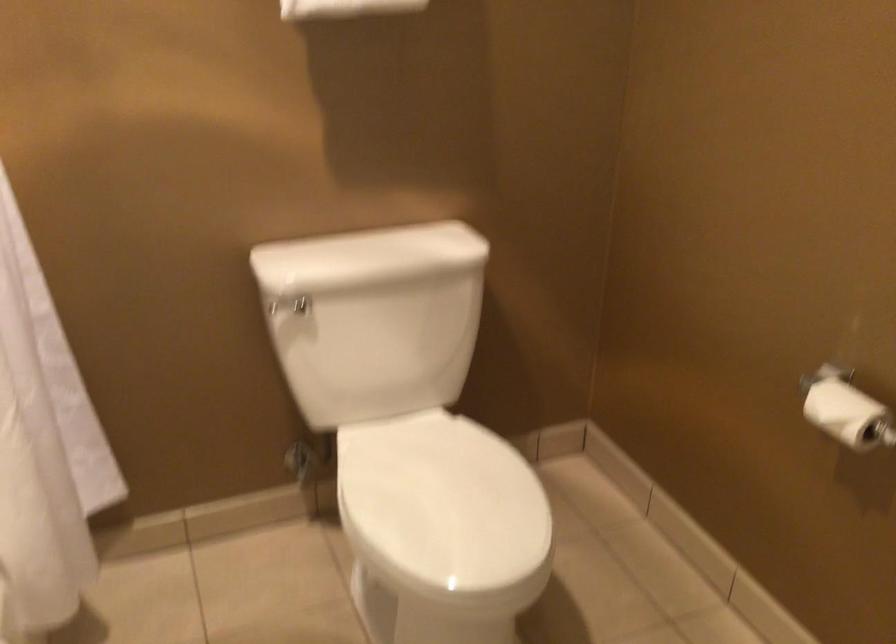
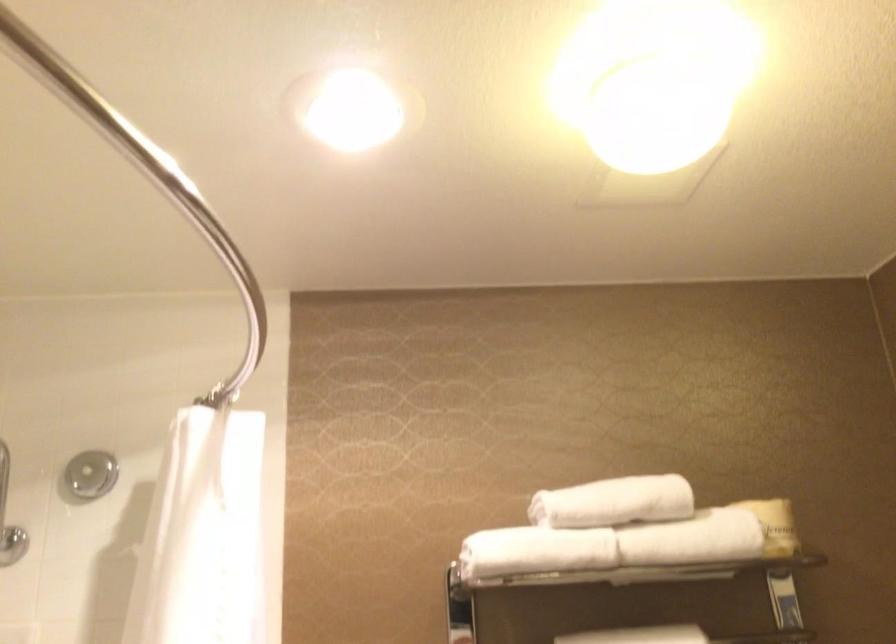
Based on the continuous images, in which direction is the camera rotating?

The camera rotated toward left-up.